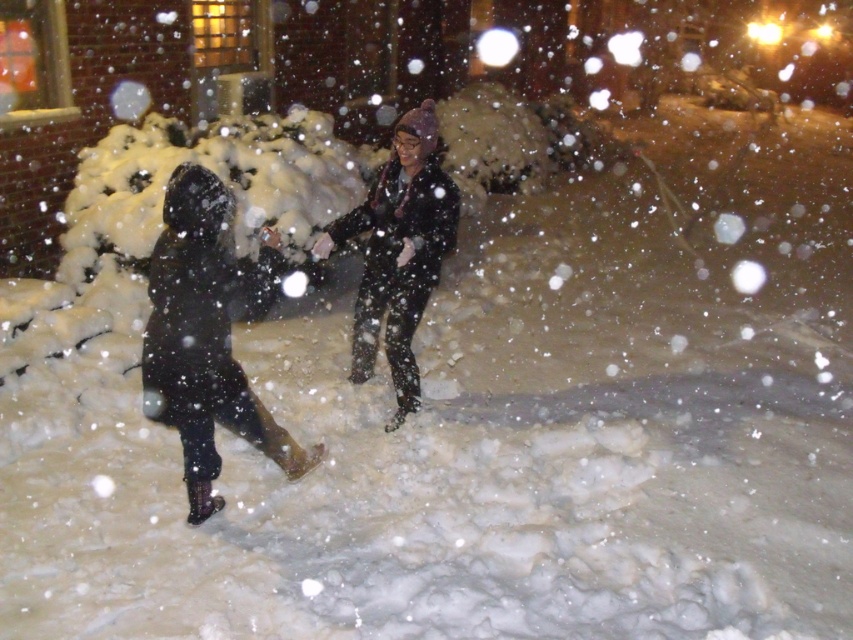
Question: In this image, where is black matte coat at left located relative to matte black jacket at center?

Choices:
 (A) right
 (B) left

Answer: (B)

Question: Which object is farther from the camera taking this photo?

Choices:
 (A) matte black jacket at center
 (B) black matte coat at left

Answer: (A)

Question: From the image, what is the correct spatial relationship of black matte coat at left in relation to matte black jacket at center?

Choices:
 (A) above
 (B) below

Answer: (B)

Question: Is black matte coat at left smaller than matte black jacket at center?

Choices:
 (A) no
 (B) yes

Answer: (B)

Question: Among these points, which one is nearest to the camera?

Choices:
 (A) (410, 208)
 (B) (207, 205)

Answer: (B)